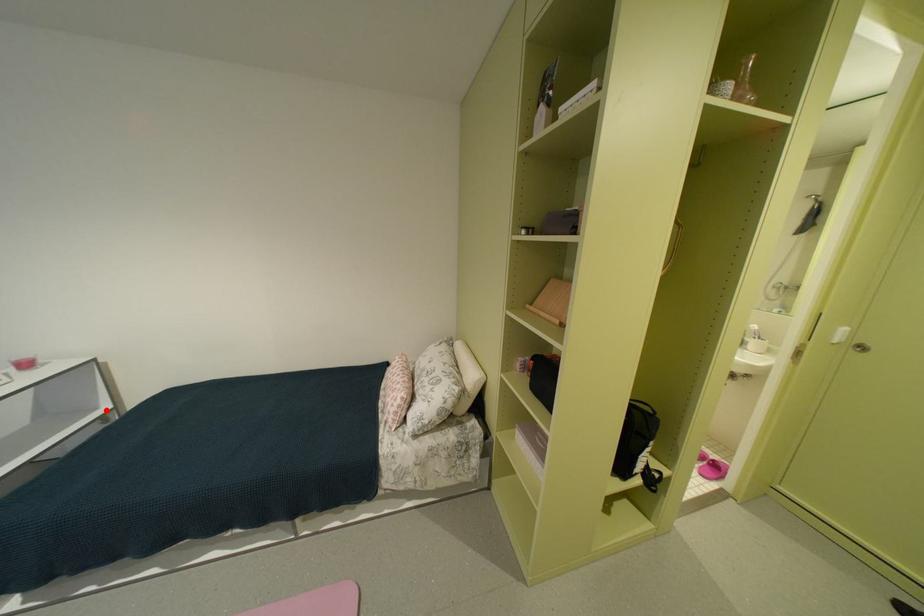
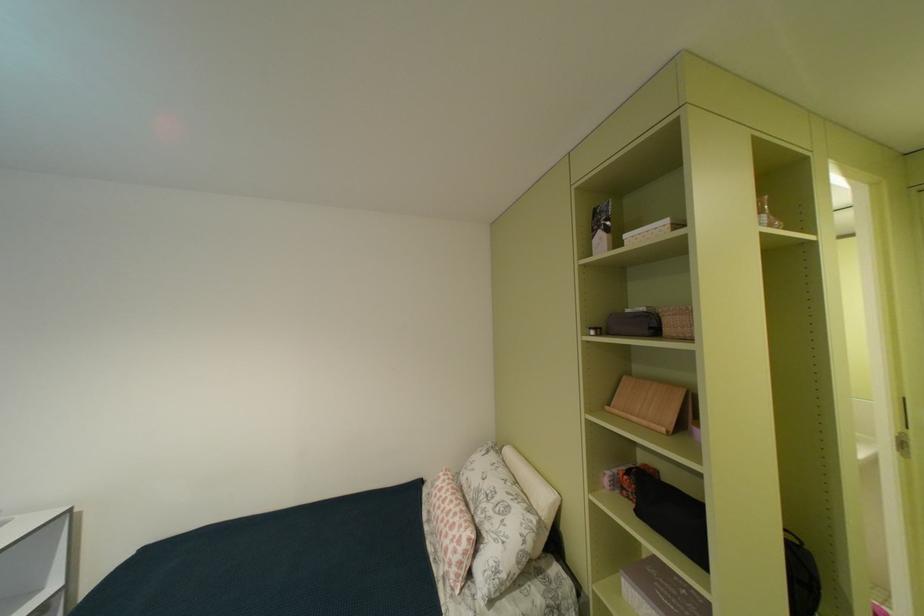
Locate, in the second image, the point that corresponds to the highlighted location in the first image.

(49, 591)